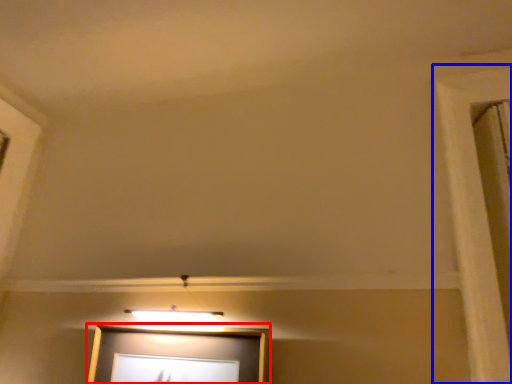
Question: Which object appears closest to the camera in this image, picture frame (highlighted by a red box) or window frame (highlighted by a blue box)?

Choices:
 (A) picture frame
 (B) window frame

Answer: (B)